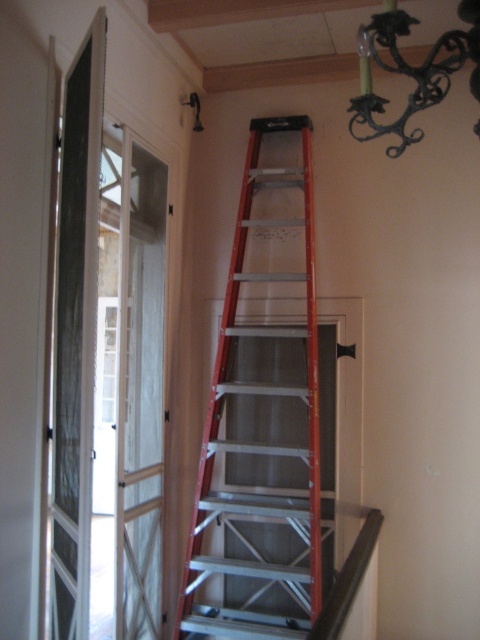
Can you confirm if orange metallic ladder at center is wider than black wrought iron chandelier at upper right?

Yes, orange metallic ladder at center is wider than black wrought iron chandelier at upper right.

Can you confirm if orange metallic ladder at center is bigger than black wrought iron chandelier at upper right?

Indeed, orange metallic ladder at center has a larger size compared to black wrought iron chandelier at upper right.

At what (x,y) coordinates should I click in order to perform the action: click on orange metallic ladder at center. Please return your answer as a coordinate pair (x, y). Image resolution: width=480 pixels, height=640 pixels. Looking at the image, I should click on (264, 419).

Where is `orange metallic ladder at center`? orange metallic ladder at center is located at coordinates (264, 419).